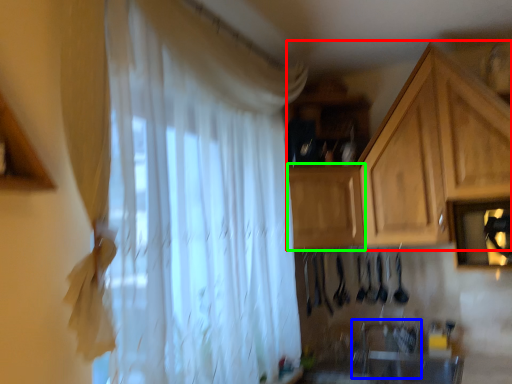
Question: Based on their relative distances, which object is farther from cabinetry (highlighted by a red box)? Choose from sink (highlighted by a blue box) and cabinetry (highlighted by a green box).

Choices:
 (A) sink
 (B) cabinetry

Answer: (A)